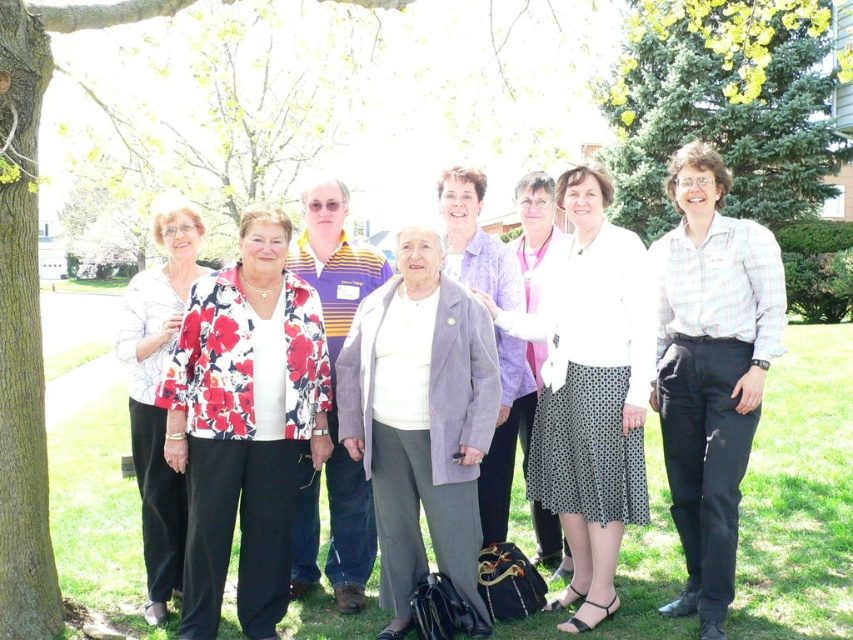
Which is above, floral fabric jacket at center or floral-patterned fabric at left?

floral fabric jacket at center is higher up.

Can you confirm if floral fabric jacket at center is wider than floral-patterned fabric at left?

Yes, floral fabric jacket at center is wider than floral-patterned fabric at left.

Image resolution: width=853 pixels, height=640 pixels. What do you see at coordinates (648, 378) in the screenshot?
I see `floral fabric jacket at center` at bounding box center [648, 378].

This screenshot has height=640, width=853. I want to click on floral fabric jacket at center, so click(x=648, y=378).

Does striped polo shirt at center appear on the right side of purple fabric jacket at center?

No, striped polo shirt at center is not to the right of purple fabric jacket at center.

Is striped polo shirt at center smaller than purple fabric jacket at center?

No.

Who is more forward, (309,493) or (544,531)?

Positioned in front is point (309,493).

What are the coordinates of `striped polo shirt at center` in the screenshot? It's located at (334, 260).

Where is `floral fabric jacket at center`? floral fabric jacket at center is located at coordinates (648, 378).

Does floral fabric jacket at center have a greater width compared to green evergreen tree at upper right?

No.

The height and width of the screenshot is (640, 853). What do you see at coordinates (648, 378) in the screenshot?
I see `floral fabric jacket at center` at bounding box center [648, 378].

At what (x,y) coordinates should I click in order to perform the action: click on floral fabric jacket at center. Please return your answer as a coordinate pair (x, y). The height and width of the screenshot is (640, 853). Looking at the image, I should click on (648, 378).